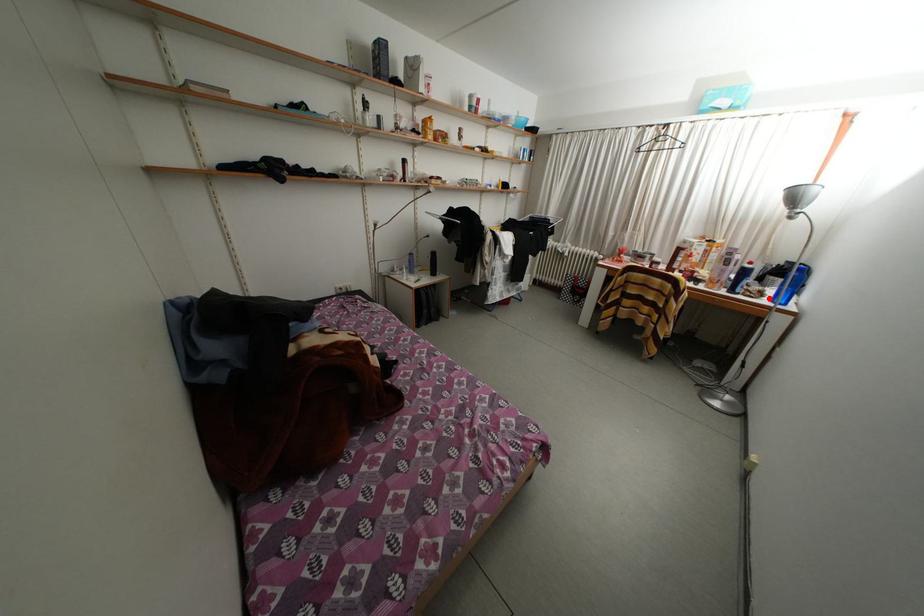
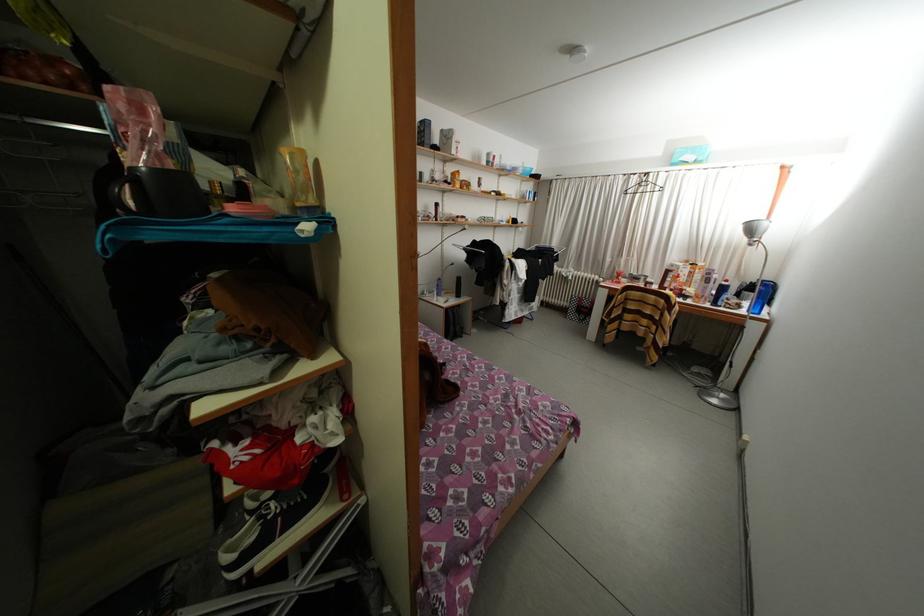
In the second image, find the point that corresponds to the highlighted location in the first image.

(747, 310)